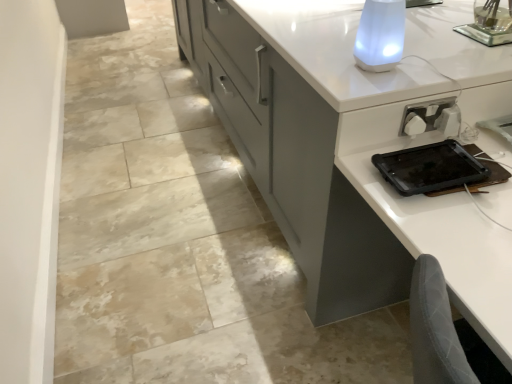
Image resolution: width=512 pixels, height=384 pixels. Find the location of `white glossy computer desk at lower right`. white glossy computer desk at lower right is located at coordinates (435, 226).

What do you see at coordinates (435, 226) in the screenshot?
I see `white glossy computer desk at lower right` at bounding box center [435, 226].

What are the coordinates of `white glossy computer desk at lower right` in the screenshot? It's located at (435, 226).